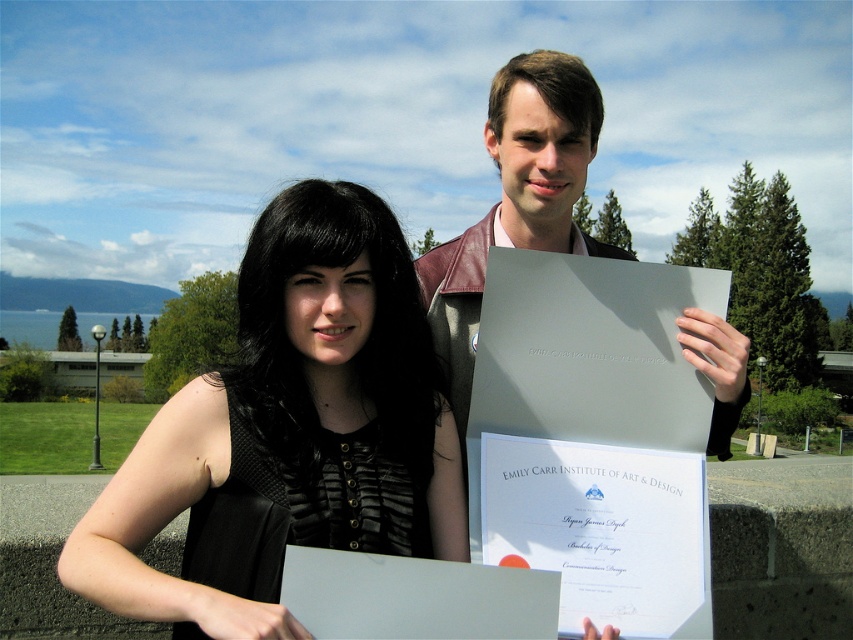
You are a photographer trying to capture both the black matte dress at center and the leather jacket at center in a single frame. Based on their positions, which one should you adjust your camera to focus on first to ensure both are in the frame?

The black matte dress at center is to the left of the leather jacket at center, so you should focus on the leather jacket at center first to ensure both are included in the frame.

You are taking a photo of two people in the park. The first person is at point (151, 531) and the second is at point (732, 342). Which person is closer to the camera?

The person at point (151, 531) is closer to the camera than the person at point (732, 342).

You are a photographer trying to capture a clear shot of the black matte dress at center and the leather jacket at center. Since both are positioned at the center, which one is closer to the camera?

The black matte dress at center is in front of the leather jacket at center, so the black matte dress at center is closer to the camera.